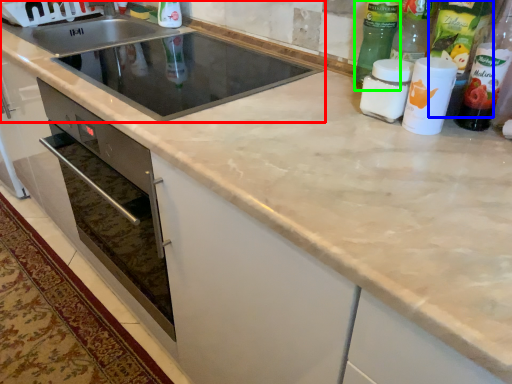
Question: Based on their relative distances, which object is farther from sink (highlighted by a red box)? Choose from bottle (highlighted by a blue box) and bottle (highlighted by a green box).

Choices:
 (A) bottle
 (B) bottle

Answer: (A)